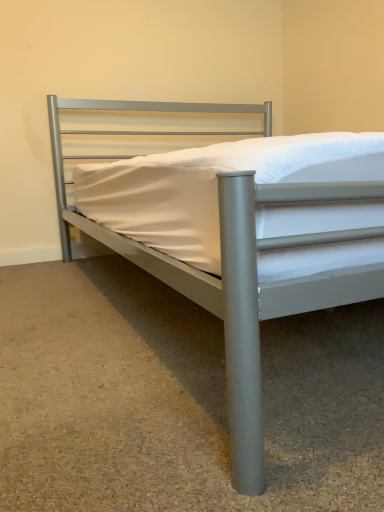
Measure the distance between silver metallic bed at center and camera.

silver metallic bed at center is 22.26 inches away from camera.

Describe the element at coordinates (233, 263) in the screenshot. The image size is (384, 512). I see `silver metallic bed at center` at that location.

Find the location of a particular element. Image resolution: width=384 pixels, height=512 pixels. silver metallic bed at center is located at coordinates (233, 263).

Locate an element on the screen. silver metallic bed at center is located at coordinates (233, 263).